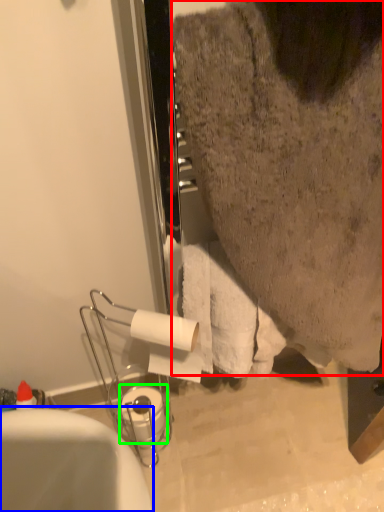
Question: Which is nearer to the person (highlighted by a red box)? bathtub (highlighted by a blue box) or toilet paper (highlighted by a green box).

Choices:
 (A) bathtub
 (B) toilet paper

Answer: (A)